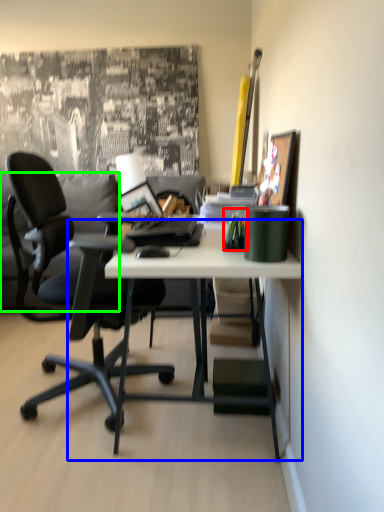
Question: Considering the real-world distances, which object is closest to stationery (highlighted by a red box)? desk (highlighted by a blue box) or pillow (highlighted by a green box).

Choices:
 (A) desk
 (B) pillow

Answer: (A)